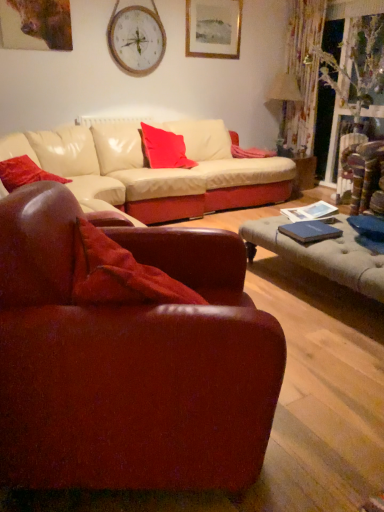
The height and width of the screenshot is (512, 384). I want to click on free location to the right of leather armchair at lower left, so click(327, 398).